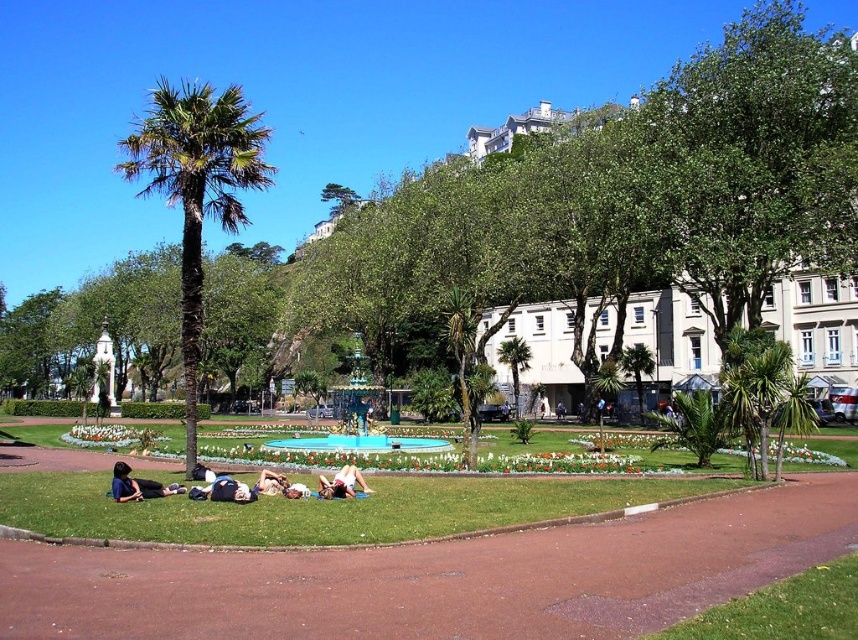
You are standing at the edge of the park and want to walk towards the white fabric person at center. Which direction should you walk to avoid passing by the green leafy palm tree at left?

You should walk to the right side of the green leafy palm tree at left to avoid passing by it while heading towards the white fabric person at center.

You are standing in the park and see two points marked in the image. Which point is closer to you, point (130, 483) or point (282, 490)?

Point (130, 483) is closer to the viewer than point (282, 490).